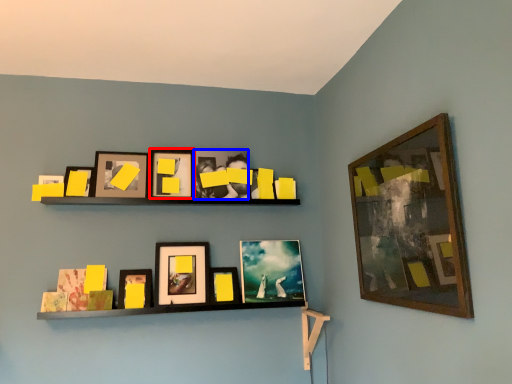
Question: Which of the following is the farthest to the observer, picture frame (highlighted by a red box) or picture frame (highlighted by a blue box)?

Choices:
 (A) picture frame
 (B) picture frame

Answer: (B)